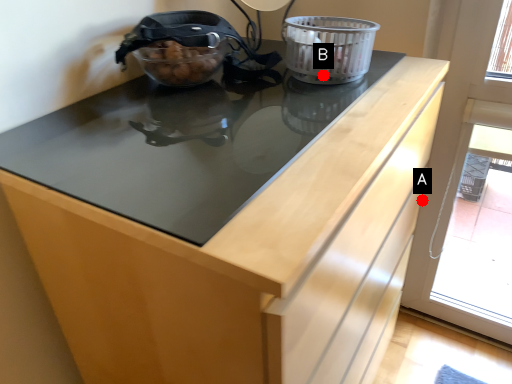
Question: Two points are circled on the image, labeled by A and B beside each circle. Which of the following is the farthest from the observer?

Choices:
 (A) A is further
 (B) B is further

Answer: (A)